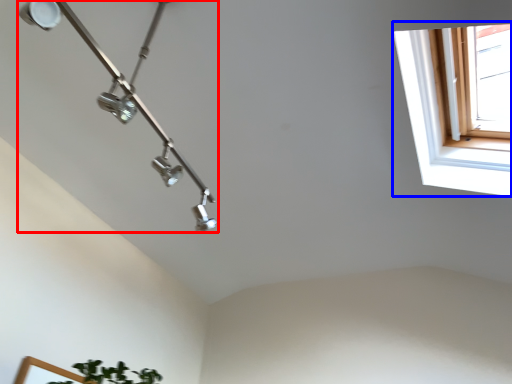
Question: Which point is further to the camera, lamp (highlighted by a red box) or window (highlighted by a blue box)?

Choices:
 (A) lamp
 (B) window

Answer: (B)